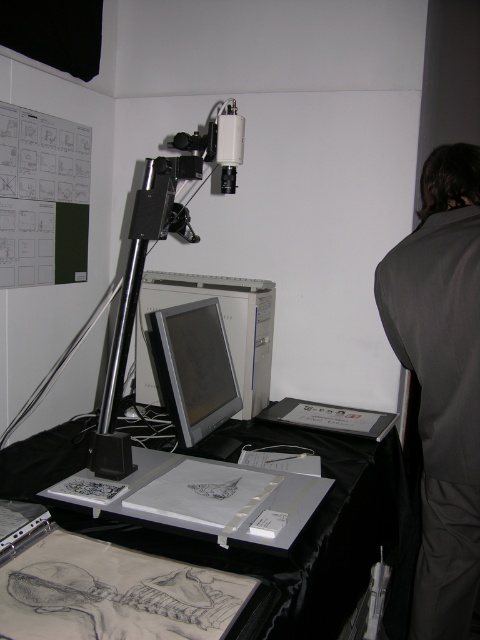
Question: In this image, where is dark gray fabric at right located relative to matte silver monitor at center?

Choices:
 (A) left
 (B) right

Answer: (B)

Question: Observing the image, what is the correct spatial positioning of metallic gray table at center in reference to matte silver monitor at center?

Choices:
 (A) above
 (B) below

Answer: (B)

Question: Which object appears farthest from the camera in this image?

Choices:
 (A) matte silver monitor at center
 (B) metallic gray table at center

Answer: (A)

Question: Which point appears closest to the camera in this image?

Choices:
 (A) (425, 451)
 (B) (155, 324)

Answer: (B)

Question: Which point is closer to the camera?

Choices:
 (A) (465, 401)
 (B) (111, 532)

Answer: (B)

Question: Can you confirm if dark gray fabric at right is positioned below matte silver monitor at center?

Choices:
 (A) yes
 (B) no

Answer: (A)